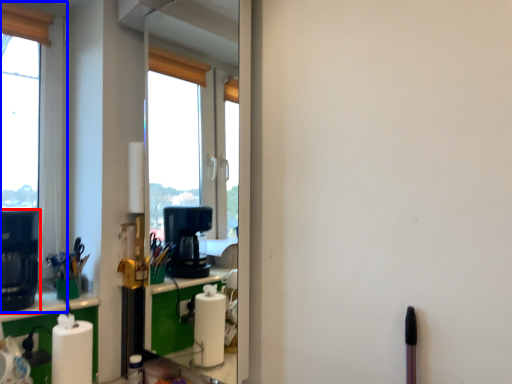
Question: Which object appears farthest to the camera in this image, coffee machine (highlighted by a red box) or window (highlighted by a blue box)?

Choices:
 (A) coffee machine
 (B) window

Answer: (B)